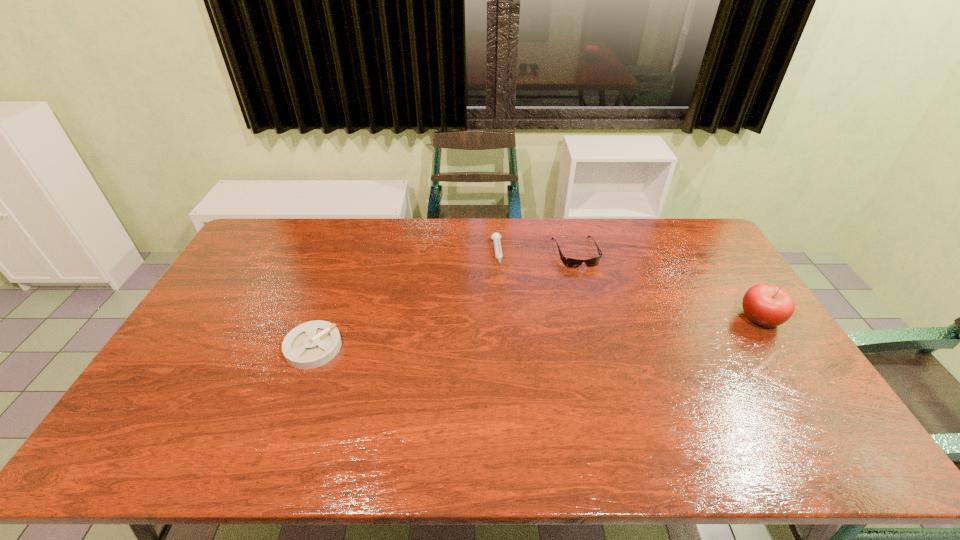
Locate an element on the screen. free space on the desktop that is between the ashtray and the rightmost object and is positioned at the needle end of the shortest object is located at coordinates (509, 335).

I want to click on free spot on the desktop that is between the leftmost object and the apple and is positioned on the front-facing side of the third object from left to right, so click(x=608, y=328).